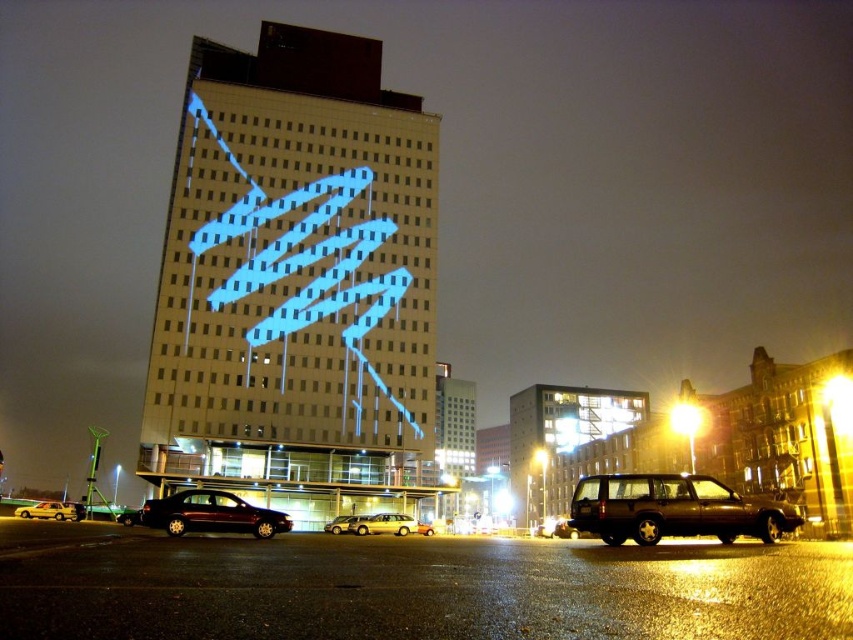
You are standing at the center of the image. Which direction should you move to reach the dark brown matte suv at lower right?

Since the dark brown matte suv at lower right is located at coordinates approximately 0.797 on the x and y axes, moving towards the lower right direction from the center would lead you to it.

You are a delivery driver who needs to park your car in the parking lot shown in the image. You see the shiny maroon sedan at lower left and the shiny gold suv at center. Which vehicle is parked higher up in the parking lot?

The shiny maroon sedan at lower left is located above the shiny gold suv at center, so it is parked higher up in the parking lot.

You are standing in the parking lot and want to take a photo of the shiny maroon sedan at lower left. If you are currently 100 feet away from it, how much closer do you need to get to ensure the car fills your camera frame properly?

The shiny maroon sedan at lower left is currently 129.15 feet away from you. To ensure the car fills your camera frame properly, you need to move closer so that the distance is reduced by approximately 29.15 feet.